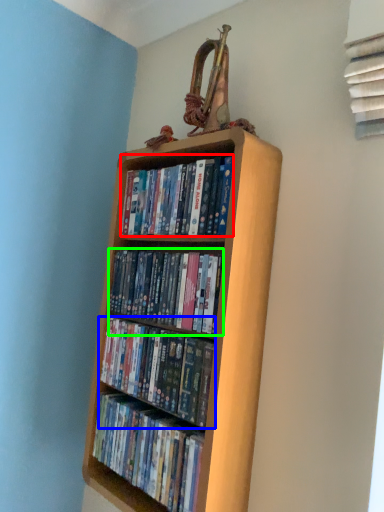
Question: Which object is the closest to the book (highlighted by a red box)? Choose among these: book (highlighted by a blue box) or book (highlighted by a green box).

Choices:
 (A) book
 (B) book

Answer: (B)